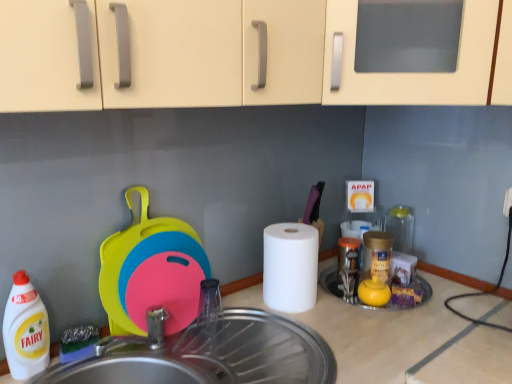
Locate an element on the screen. free space above metallic stainless steel sink at lower center (from a real-world perspective) is located at coordinates (234, 349).